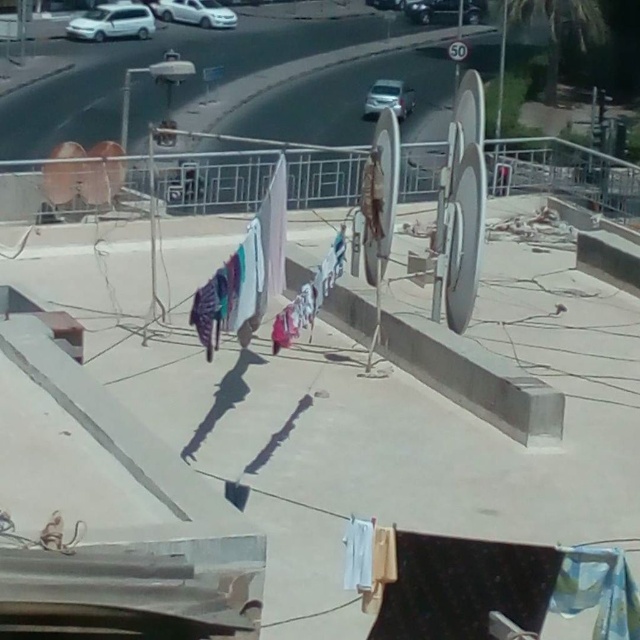
Question: Which of these objects is positioned farthest from the shiny silver sedan at upper center?

Choices:
 (A) white glossy car at upper center
 (B) white matte van at upper left
 (C) shiny silver car at upper center
 (D) white glossy car at upper left

Answer: (A)

Question: Can you confirm if shiny silver car at upper center is wider than shiny silver sedan at upper center?

Choices:
 (A) no
 (B) yes

Answer: (A)

Question: Is shiny silver car at upper center to the left of white glossy car at upper center from the viewer's perspective?

Choices:
 (A) yes
 (B) no

Answer: (B)

Question: Where is white glossy car at upper left located in relation to shiny silver sedan at upper center in the image?

Choices:
 (A) above
 (B) below

Answer: (B)

Question: Which point is closer to the camera?

Choices:
 (A) (403, 0)
 (B) (465, 17)
 (C) (408, 109)

Answer: (C)

Question: Considering the real-world distances, which object is farthest from the shiny silver car at upper center?

Choices:
 (A) shiny silver sedan at upper center
 (B) white matte van at upper left

Answer: (B)